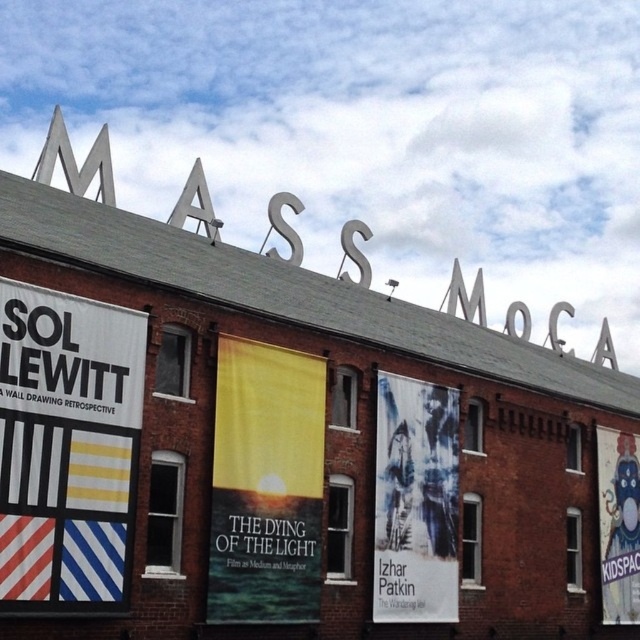
Does point (244, 438) come in front of point (424, 595)?

Yes, point (244, 438) is closer to viewer.

Between point (252, 554) and point (429, 568), which one is positioned behind?

Positioned behind is point (429, 568).

What do you see at coordinates (266, 484) in the screenshot?
I see `yellow matte banner at center` at bounding box center [266, 484].

Where is `yellow matte banner at center`? yellow matte banner at center is located at coordinates (266, 484).

Does point (412, 497) lie behind point (625, 504)?

No, it is in front of (625, 504).

Between blue fabric poster at center and cartoonish fabric poster at right, which one appears on the right side from the viewer's perspective?

Positioned to the right is cartoonish fabric poster at right.

Locate an element on the screen. The image size is (640, 640). blue fabric poster at center is located at coordinates (416, 500).

Does point (268, 384) come behind point (637, 458)?

No, (268, 384) is closer to viewer.

Image resolution: width=640 pixels, height=640 pixels. What are the coordinates of `yellow matte banner at center` in the screenshot? It's located at (266, 484).